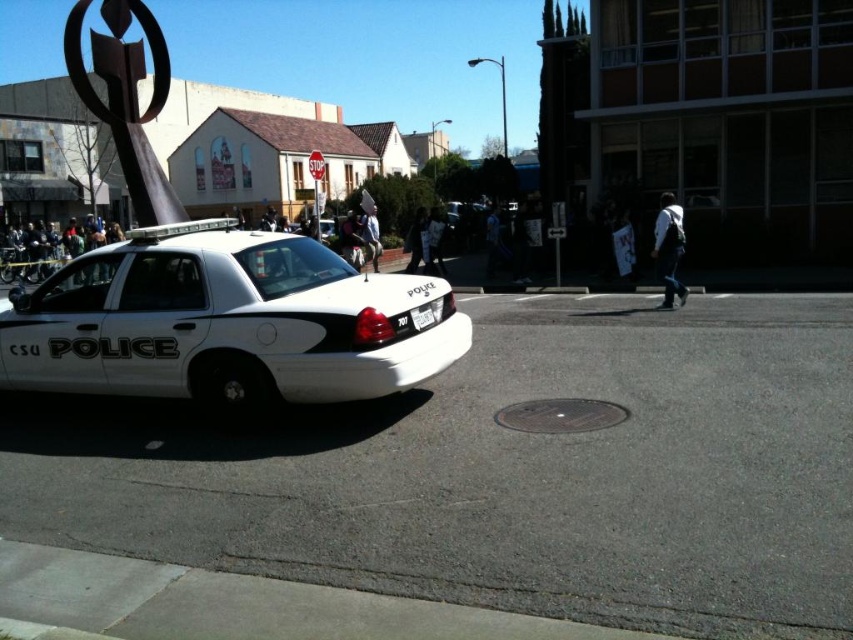
In the scene shown: Can you confirm if white glossy police car at center is thinner than white plastic license plate at center?

In fact, white glossy police car at center might be wider than white plastic license plate at center.

Between white glossy police car at center and white plastic license plate at center, which one appears on the left side from the viewer's perspective?

Positioned to the left is white glossy police car at center.

What do you see at coordinates (224, 323) in the screenshot? I see `white glossy police car at center` at bounding box center [224, 323].

Where is `white glossy police car at center`? The width and height of the screenshot is (853, 640). white glossy police car at center is located at coordinates (224, 323).